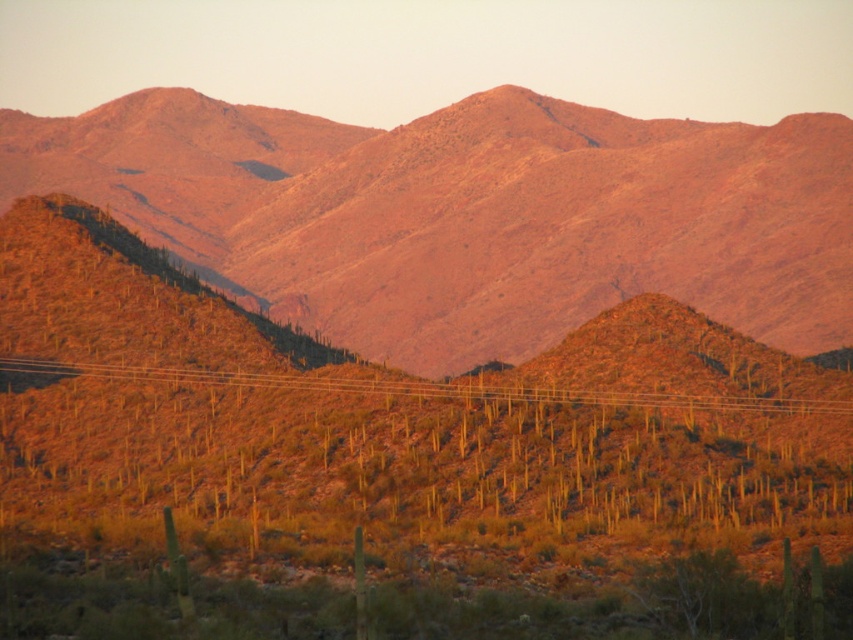
You are a photographer setting up a tripod in the desert. You want to capture both the desert sand at center and the metallic wire at center in your shot. Which object will appear closer to the camera in the final photo?

The desert sand at center will appear closer to the camera because the metallic wire at center is positioned behind it.

You are a desert explorer carrying a 2 meter wide tent. You want to set it up in the area where you see the desert sand at center and metallic wire at center. Can you fit your tent between them?

The desert sand at center might be wider than metallic wire at center, so there is a possibility that the tent can be placed between them if the space between them is at least 2 meters wide.

From the picture: You are a desert explorer who needs to cross the desert sand at center. There is a metallic wire at center in your path. Which obstacle is larger in size that you need to navigate around?

The desert sand at center is bigger than the metallic wire at center, so you need to navigate around the desert sand at center first.